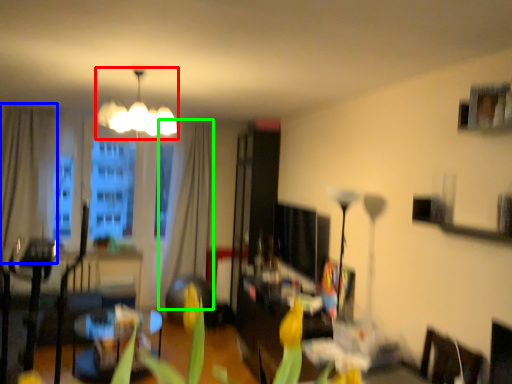
Question: Considering the real-world distances, which object is farthest from lamp (highlighted by a red box)? curtain (highlighted by a blue box) or curtain (highlighted by a green box)?

Choices:
 (A) curtain
 (B) curtain

Answer: (A)